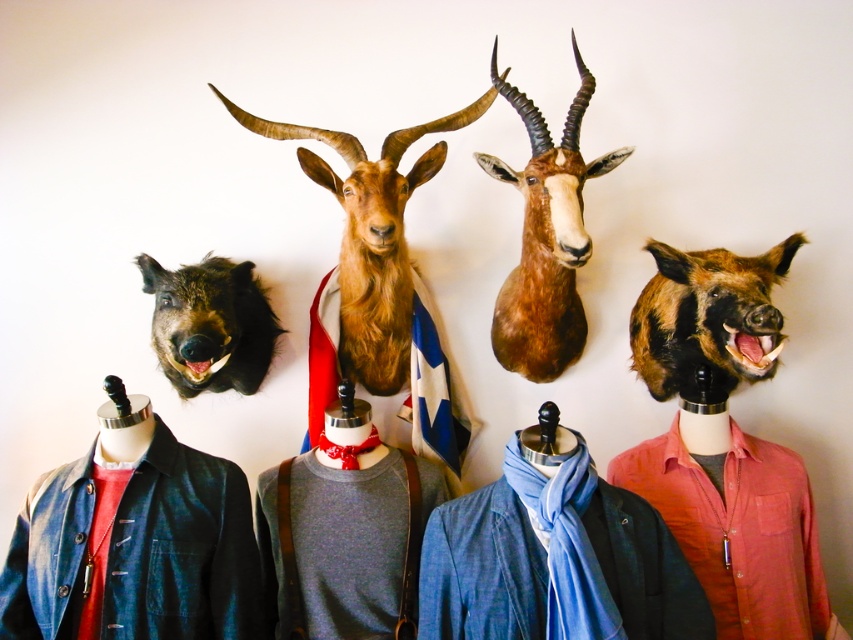
Does denim jacket at lower left appear over brown matte goat head at center?

Incorrect, denim jacket at lower left is not positioned above brown matte goat head at center.

Locate an element on the screen. denim jacket at lower left is located at coordinates (183, 548).

Is point (697, 337) behind point (175, 480)?

Yes.

I want to click on matte brown pig head at center, so click(x=724, y=444).

From the picture: Is blue denim jacket at lower center to the right of fuzzy brown moose head at left from the viewer's perspective?

Correct, you'll find blue denim jacket at lower center to the right of fuzzy brown moose head at left.

Which is behind, point (495, 493) or point (238, 385)?

The point (238, 385) is behind.

Where is `blue denim jacket at lower center`? blue denim jacket at lower center is located at coordinates (555, 563).

Where is `blue denim jacket at lower center`? Image resolution: width=853 pixels, height=640 pixels. blue denim jacket at lower center is located at coordinates (555, 563).